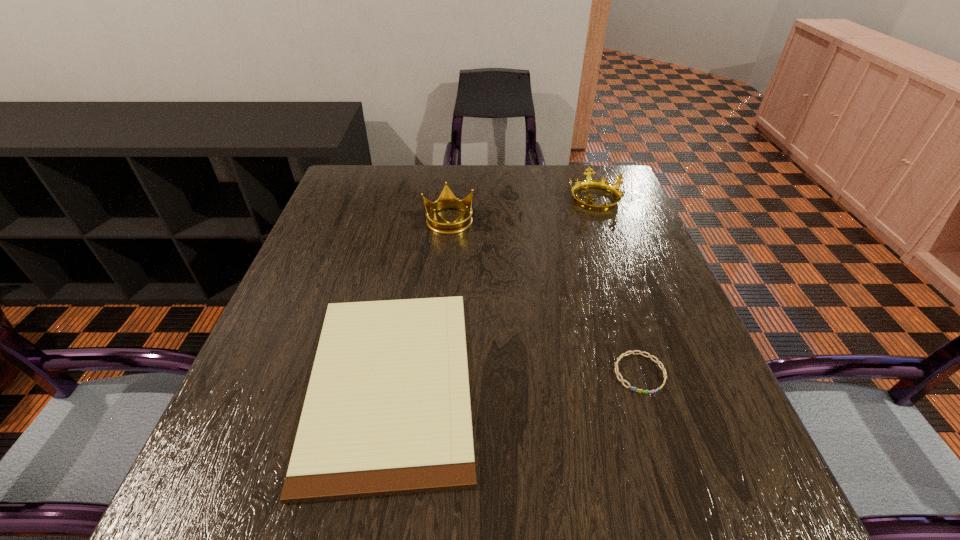
Image resolution: width=960 pixels, height=540 pixels. I want to click on vacant space at the near left corner of the desktop, so click(204, 498).

You are a GUI agent. You are given a task and a screenshot of the screen. Output one action in this format:
    pyautogui.click(x=<x>, y=<y>)
    Task: Click on the vacant space at the far right corner
    
    Given the screenshot: What is the action you would take?
    pyautogui.click(x=630, y=201)

Where is `vacant region between the taller crown and the bracelet`? vacant region between the taller crown and the bracelet is located at coordinates (x=544, y=296).

This screenshot has height=540, width=960. I want to click on free space between the shorter crown and the clipboard, so click(492, 290).

This screenshot has width=960, height=540. Find the location of `empty space that is in between the third shortest object and the clipboard`. empty space that is in between the third shortest object and the clipboard is located at coordinates (492, 290).

Where is `vacant point located between the taller crown and the shorter crown`? vacant point located between the taller crown and the shorter crown is located at coordinates (521, 210).

You are a GUI agent. You are given a task and a screenshot of the screen. Output one action in this format:
    pyautogui.click(x=<x>, y=<y>)
    Task: Click on the blank region between the right crown and the taller crown
    This screenshot has height=540, width=960.
    Given the screenshot: What is the action you would take?
    pyautogui.click(x=521, y=210)

Locate an element on the screen. The width and height of the screenshot is (960, 540). free space between the bracelet and the shorter crown is located at coordinates (617, 286).

In order to click on free space between the bracelet and the second tallest object in this screenshot , I will do `click(617, 286)`.

Identify the location of free space between the bracelet and the right crown. The width and height of the screenshot is (960, 540). (617, 286).